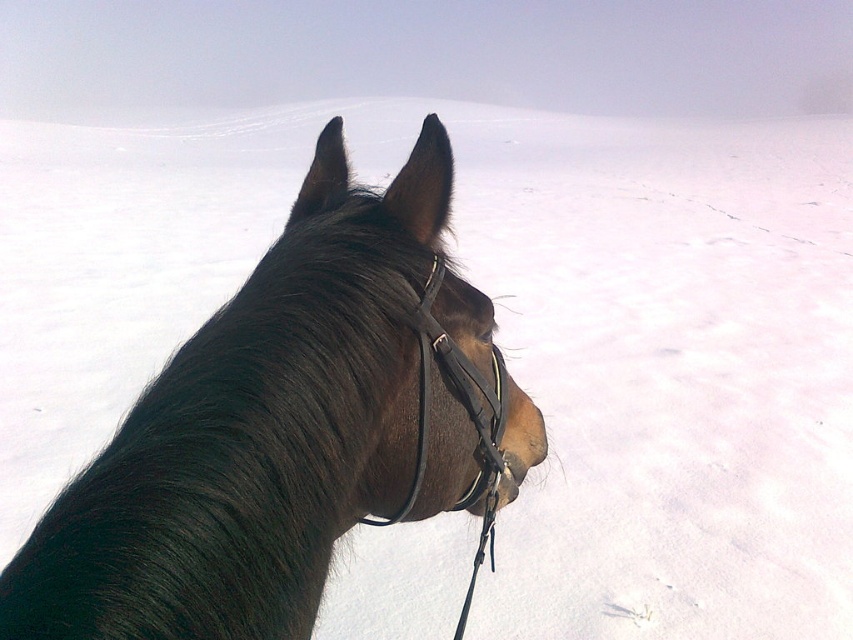
You are a photographer trying to capture a close up of the shiny brown horse at center and the black leather bridle at center. Since you want to focus on the horse, which object should you adjust your camera settings to prioritize in terms of size?

The shiny brown horse at center is larger in size than the black leather bridle at center, so you should prioritize focusing on the shiny brown horse at center as it occupies more space in the frame.

You are a photographer trying to capture the shiny brown horse at center in the best possible way. Based on its position, where should you focus your camera to ensure the horse is in sharp focus?

The shiny brown horse at center is located at point (x=289, y=428), so you should focus your camera at that coordinate to ensure the horse is in sharp focus.

You are a photographer standing in front of the shiny brown horse at center and the black leather bridle at center. You want to take a photo focusing on the horse without the bridle being visible. Is the position of the bridle making this possible?

The shiny brown horse at center is in front of the black leather bridle at center, so the bridle is behind the horse. Therefore, if you position yourself so the horse is between you and the bridle, the bridle will not be visible in the photo.